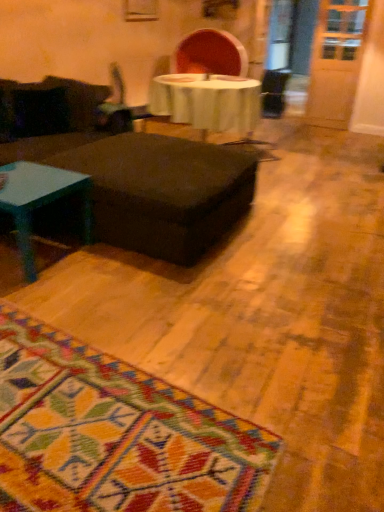
Question: Is matte black ottoman at center far away from metallic silver swivel chair at center?

Choices:
 (A) yes
 (B) no

Answer: (A)

Question: Is matte black ottoman at center oriented away from metallic silver swivel chair at center?

Choices:
 (A) no
 (B) yes

Answer: (A)

Question: Is matte black ottoman at center bigger than metallic silver swivel chair at center?

Choices:
 (A) no
 (B) yes

Answer: (B)

Question: Is matte black ottoman at center wider than metallic silver swivel chair at center?

Choices:
 (A) no
 (B) yes

Answer: (B)

Question: Could metallic silver swivel chair at center be considered to be inside matte black ottoman at center?

Choices:
 (A) no
 (B) yes

Answer: (A)

Question: Choose the correct answer: Is matte black ottoman at center inside teal glossy coffee table at left or outside it?

Choices:
 (A) inside
 (B) outside

Answer: (B)

Question: In the image, is matte black ottoman at center positioned in front of or behind teal glossy coffee table at left?

Choices:
 (A) behind
 (B) front

Answer: (A)

Question: From the image's perspective, is matte black ottoman at center located above or below teal glossy coffee table at left?

Choices:
 (A) above
 (B) below

Answer: (A)

Question: Is matte black ottoman at center wider or thinner than teal glossy coffee table at left?

Choices:
 (A) wide
 (B) thin

Answer: (A)

Question: Looking at the image, does metallic silver swivel chair at center seem bigger or smaller compared to teal glossy coffee table at left?

Choices:
 (A) small
 (B) big

Answer: (A)

Question: Is metallic silver swivel chair at center wider or thinner than teal glossy coffee table at left?

Choices:
 (A) wide
 (B) thin

Answer: (B)

Question: Does point (122, 108) appear closer or farther from the camera than point (21, 246)?

Choices:
 (A) farther
 (B) closer

Answer: (A)

Question: Is metallic silver swivel chair at center to the left or to the right of teal glossy coffee table at left in the image?

Choices:
 (A) right
 (B) left

Answer: (A)

Question: From a real-world perspective, is metallic silver swivel chair at center physically located above or below matte black ottoman at center?

Choices:
 (A) above
 (B) below

Answer: (A)

Question: Considering their positions, is metallic silver swivel chair at center located in front of or behind matte black ottoman at center?

Choices:
 (A) front
 (B) behind

Answer: (B)